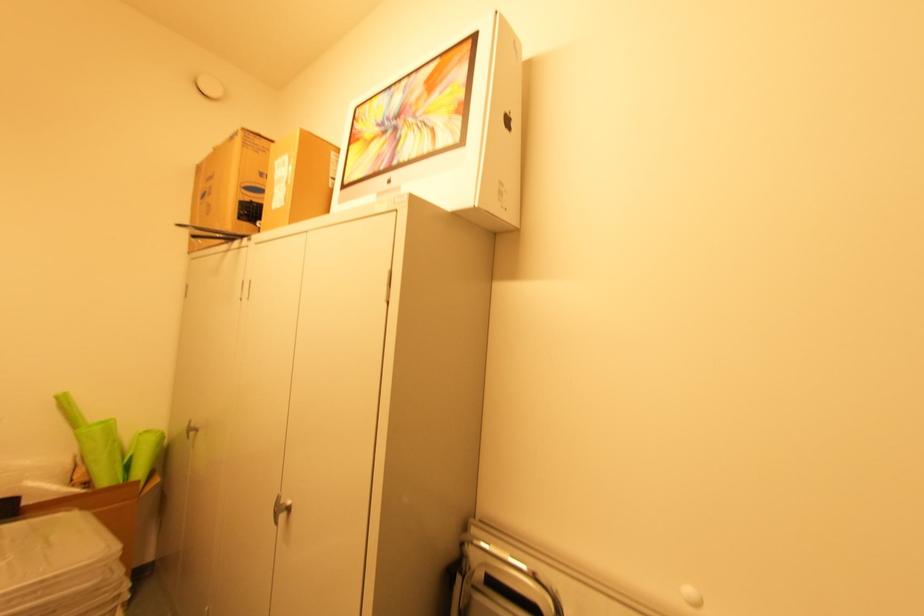
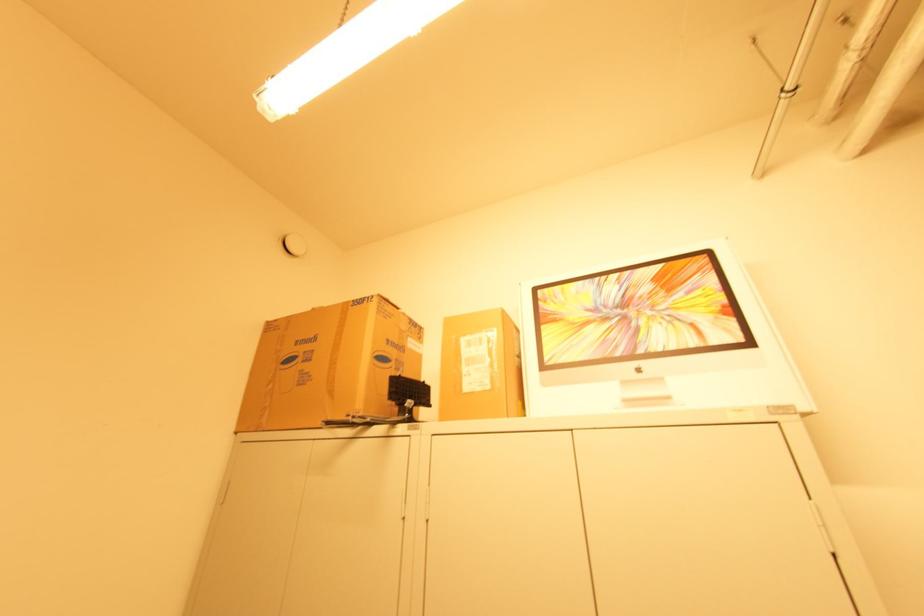
Find the pixel in the second image that matches (x=216, y=148) in the first image.

(315, 309)